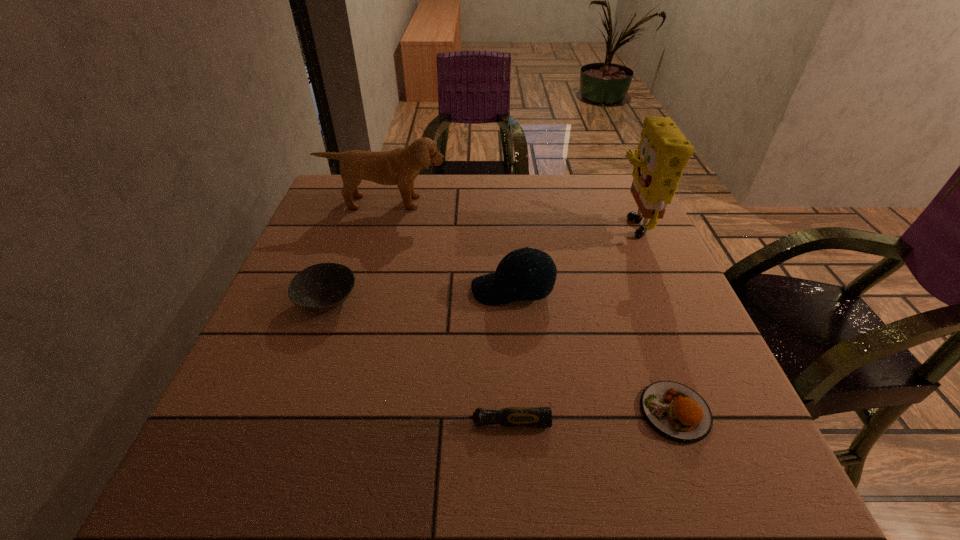
Locate an element on the screen. The width and height of the screenshot is (960, 540). free region at the near left corner of the desktop is located at coordinates (253, 497).

I want to click on vacant area that lies between the patty and the screwdriver, so click(578, 417).

I want to click on vacant region between the screwdriver and the tallest object, so click(x=556, y=322).

I want to click on unoccupied position between the bowl and the patty, so click(501, 356).

Identify the location of free space between the puppy and the sponge. (509, 212).

Where is `free space between the fourth shortest object and the puppy`? The image size is (960, 540). free space between the fourth shortest object and the puppy is located at coordinates (449, 246).

In order to click on vacant area that lies between the puppy and the fourth tallest object in this screenshot , I will do `click(356, 252)`.

Where is `unoccupied area between the puppy and the fifth tallest object`? The width and height of the screenshot is (960, 540). unoccupied area between the puppy and the fifth tallest object is located at coordinates (530, 307).

At what (x,y) coordinates should I click in order to perform the action: click on empty location between the screwdriver and the second shortest object. Please return your answer as a coordinate pair (x, y). The height and width of the screenshot is (540, 960). Looking at the image, I should click on (578, 417).

Locate an element on the screen. vacant space that's between the patty and the baseball cap is located at coordinates (594, 351).